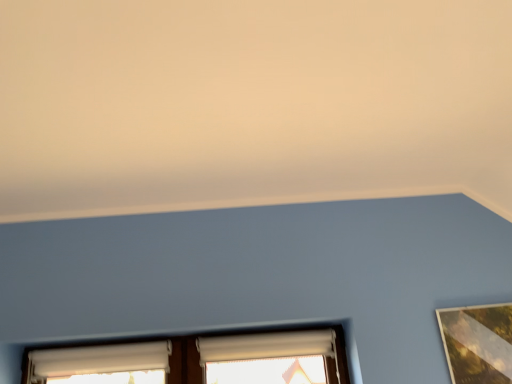
Question: In terms of height, does white matte window at lower left, which is counted as the first window, starting from the left, look taller or shorter compared to white fabric window at center, which is the 2th window in left-to-right order?

Choices:
 (A) short
 (B) tall

Answer: (B)

Question: Relative to white fabric window at center, marked as the 1th window in a right-to-left arrangement, is white matte window at lower left, placed as the second window when sorted from right to left, in front or behind?

Choices:
 (A) front
 (B) behind

Answer: (A)

Question: Would you say white matte window at lower left, placed as the second window when sorted from right to left, is inside or outside white fabric window at center, which is the 2th window in left-to-right order?

Choices:
 (A) outside
 (B) inside

Answer: (A)

Question: From their relative heights in the image, would you say white fabric window at center, marked as the 1th window in a right-to-left arrangement, is taller or shorter than white matte window at lower left, placed as the second window when sorted from right to left?

Choices:
 (A) short
 (B) tall

Answer: (A)

Question: Relative to white matte window at lower left, which is counted as the first window, starting from the left, is white fabric window at center, which is the 2th window in left-to-right order, in front or behind?

Choices:
 (A) front
 (B) behind

Answer: (B)

Question: Is white fabric window at center, marked as the 1th window in a right-to-left arrangement, inside the boundaries of white matte window at lower left, which is counted as the first window, starting from the left, or outside?

Choices:
 (A) outside
 (B) inside

Answer: (A)

Question: From a real-world perspective, is white fabric window at center, which is the 2th window in left-to-right order, above or below white matte window at lower left, which is counted as the first window, starting from the left?

Choices:
 (A) above
 (B) below

Answer: (A)